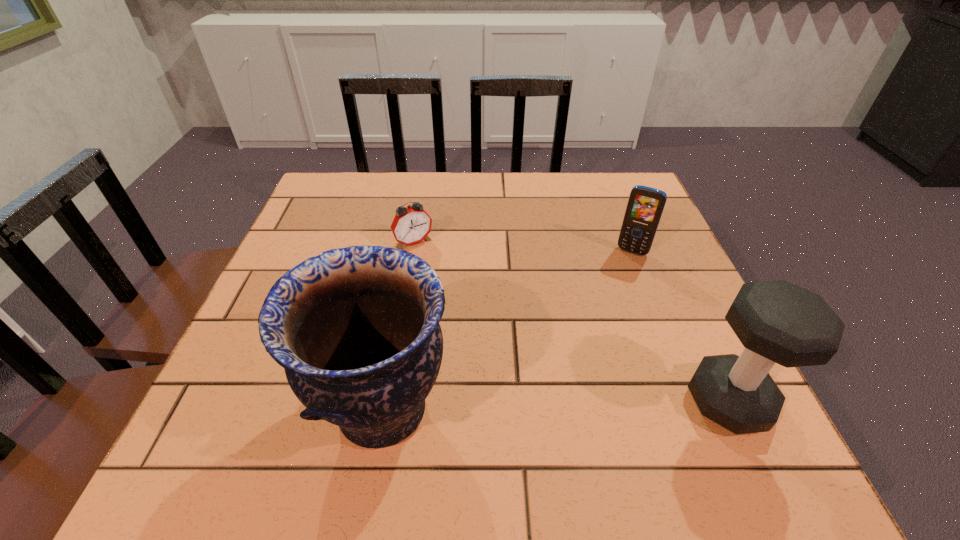
This screenshot has height=540, width=960. In order to click on vacant space located on the screen of the third tallest object in this screenshot , I will do `click(621, 270)`.

Where is `free location located on the clock face of the shortest object`? free location located on the clock face of the shortest object is located at coordinates (488, 347).

Locate an element on the screen. This screenshot has width=960, height=540. blank area located 0.210m on the clock face of the shortest object is located at coordinates (461, 307).

Where is `vacant space located 0.100m on the clock face of the shortest object`? The height and width of the screenshot is (540, 960). vacant space located 0.100m on the clock face of the shortest object is located at coordinates (439, 275).

Where is `pottery positioned at the near edge`? Image resolution: width=960 pixels, height=540 pixels. pottery positioned at the near edge is located at coordinates (356, 329).

The image size is (960, 540). What are the coordinates of `dumbbell situated at the near edge` in the screenshot? It's located at (778, 322).

In order to click on dumbbell at the right edge in this screenshot , I will do `click(778, 322)`.

Locate an element on the screen. The height and width of the screenshot is (540, 960). cellular telephone at the right edge is located at coordinates (645, 206).

The width and height of the screenshot is (960, 540). What are the coordinates of `object at the near right corner` in the screenshot? It's located at (778, 322).

In the image, there is a desktop. Where is `free space at the far edge`? This screenshot has height=540, width=960. free space at the far edge is located at coordinates (396, 191).